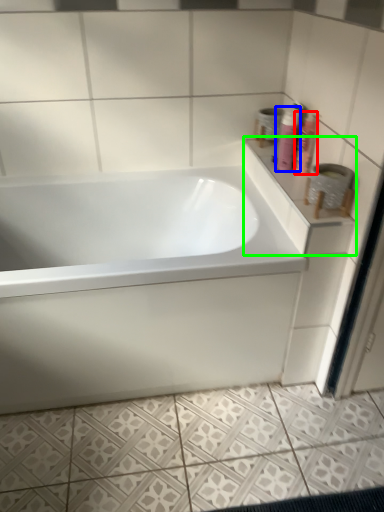
Question: Which object is positioned closest to shaving cream (highlighted by a red box)? Select from shaving cream (highlighted by a blue box) and counter top (highlighted by a green box).

Choices:
 (A) shaving cream
 (B) counter top

Answer: (A)